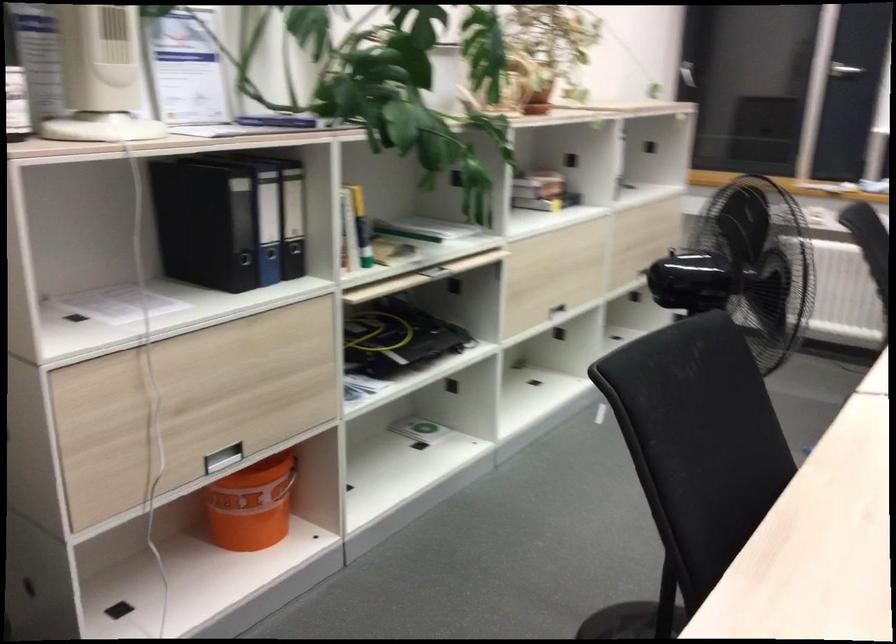
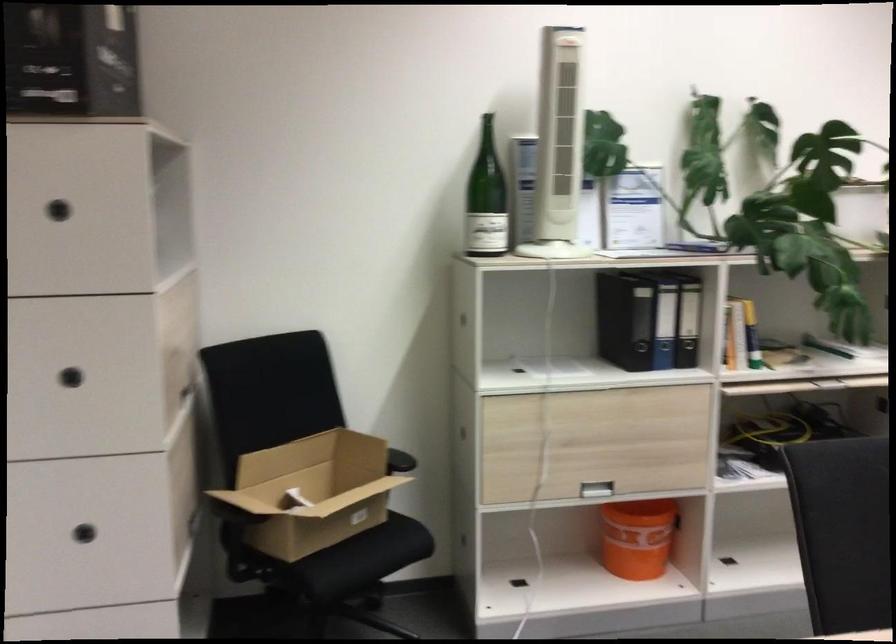
In the second image, find the point that corresponds to point (295, 218) in the first image.

(688, 321)